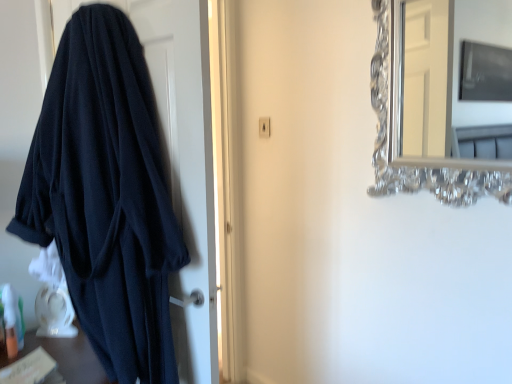
From the picture: What is the approximate width of dark blue fabric at left?

dark blue fabric at left is 6.74 inches wide.

Describe the element at coordinates (180, 159) in the screenshot. I see `dark blue fabric at left` at that location.

Locate an element on the screen. The height and width of the screenshot is (384, 512). dark blue fabric at left is located at coordinates (180, 159).

In order to face dark blue fabric at left, should I rotate leftwards or rightwards?

Turn left approximately 16.495 degrees to face it.

What is the approximate height of silver metallic mirror at upper right?

27.60 inches.

At what (x,y) coordinates should I click in order to perform the action: click on silver metallic mirror at upper right. Please return your answer as a coordinate pair (x, y). Looking at the image, I should click on (447, 70).

What do you see at coordinates (447, 70) in the screenshot? I see `silver metallic mirror at upper right` at bounding box center [447, 70].

You are a GUI agent. You are given a task and a screenshot of the screen. Output one action in this format:
    pyautogui.click(x=<x>, y=<y>)
    Task: Click on the dark blue fabric at left
    
    Given the screenshot: What is the action you would take?
    pyautogui.click(x=180, y=159)

Is dark blue fabric at left to the left of silver metallic mirror at upper right from the viewer's perspective?

Yes.

Between dark blue fabric at left and silver metallic mirror at upper right, which one is positioned in front?

silver metallic mirror at upper right is closer to the camera.

Considering the positions of points (215, 248) and (425, 150), is point (215, 248) farther from camera compared to point (425, 150)?

That is False.

From the image's perspective, which one is positioned lower, dark blue fabric at left or silver metallic mirror at upper right?

dark blue fabric at left, from the image's perspective.

From a real-world perspective, is dark blue fabric at left over silver metallic mirror at upper right?

No, from a real-world perspective, dark blue fabric at left is not on top of silver metallic mirror at upper right.

Between dark blue fabric at left and silver metallic mirror at upper right, which one has larger width?

dark blue fabric at left is wider.

Is dark blue fabric at left shorter than silver metallic mirror at upper right?

No.

Considering the relative sizes of dark blue fabric at left and silver metallic mirror at upper right in the image provided, is dark blue fabric at left bigger than silver metallic mirror at upper right?

Correct, dark blue fabric at left is larger in size than silver metallic mirror at upper right.

Could silver metallic mirror at upper right be considered to be inside dark blue fabric at left?

No.

Are dark blue fabric at left and silver metallic mirror at upper right far apart?

Absolutely, dark blue fabric at left is distant from silver metallic mirror at upper right.

Is dark blue fabric at left facing away from silver metallic mirror at upper right?

Answer: No, dark blue fabric at left is not facing the opposite direction of silver metallic mirror at upper right.

What's the angular difference between dark blue fabric at left and silver metallic mirror at upper right's facing directions?

They differ by 165 degrees in their facing directions.

How far apart are dark blue fabric at left and silver metallic mirror at upper right?

dark blue fabric at left is 9.64 feet from silver metallic mirror at upper right.

This screenshot has width=512, height=384. Find the location of `door behind the silver metallic mirror at upper right`. door behind the silver metallic mirror at upper right is located at coordinates [x=180, y=159].

Which is more to the right, silver metallic mirror at upper right or dark blue fabric at left?

From the viewer's perspective, silver metallic mirror at upper right appears more on the right side.

Relative to dark blue fabric at left, is silver metallic mirror at upper right in front or behind?

Clearly, silver metallic mirror at upper right is in front of dark blue fabric at left.

Considering the positions of points (429, 9) and (163, 17), is point (429, 9) farther from camera compared to point (163, 17)?

Yes, it is behind point (163, 17).

From the image's perspective, is silver metallic mirror at upper right located above dark blue fabric at left?

Yes, from the image's perspective, silver metallic mirror at upper right is over dark blue fabric at left.

From a real-world perspective, which is physically above, silver metallic mirror at upper right or dark blue fabric at left?

silver metallic mirror at upper right.

Between silver metallic mirror at upper right and dark blue fabric at left, which one has smaller width?

With smaller width is silver metallic mirror at upper right.

Based on the photo, can you confirm if silver metallic mirror at upper right is shorter than dark blue fabric at left?

Indeed, silver metallic mirror at upper right has a lesser height compared to dark blue fabric at left.

Who is smaller, silver metallic mirror at upper right or dark blue fabric at left?

silver metallic mirror at upper right is smaller.

Can we say silver metallic mirror at upper right lies outside dark blue fabric at left?

That's correct, silver metallic mirror at upper right is outside of dark blue fabric at left.

Is silver metallic mirror at upper right beside dark blue fabric at left?

No, silver metallic mirror at upper right is not beside dark blue fabric at left.

Is silver metallic mirror at upper right facing towards dark blue fabric at left?

No, silver metallic mirror at upper right is not aimed at dark blue fabric at left.

Can you tell me how much silver metallic mirror at upper right and dark blue fabric at left differ in facing direction?

They differ by 165 degrees in their facing directions.

Locate an element on the screen. The height and width of the screenshot is (384, 512). door below the silver metallic mirror at upper right (from the image's perspective) is located at coordinates (180, 159).

Locate an element on the screen. mirror above the dark blue fabric at left (from a real-world perspective) is located at coordinates (447, 70).

Where is `door behind the silver metallic mirror at upper right`? The image size is (512, 384). door behind the silver metallic mirror at upper right is located at coordinates (180, 159).